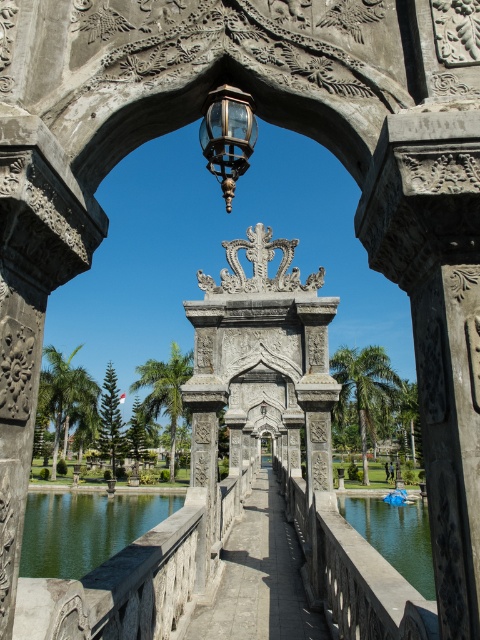
Question: Which point is closer to the camera?

Choices:
 (A) (38, 536)
 (B) (372, 499)
 (C) (216, 620)

Answer: (C)

Question: Which object is the farthest from the gray stone path at center?

Choices:
 (A) green liquid water at bridge center
 (B) matte glass lantern at center
 (C) green reflective water at lower left

Answer: (C)

Question: Which point appears closest to the camera in this image?

Choices:
 (A) (240, 154)
 (B) (105, 554)

Answer: (A)

Question: In this image, where is gray stone path at center located relative to green liquid water at bridge center?

Choices:
 (A) left
 (B) right

Answer: (A)

Question: Can you confirm if gray stone path at center is positioned to the right of matte glass lantern at center?

Choices:
 (A) no
 (B) yes

Answer: (B)

Question: Can you confirm if green reflective water at lower left is positioned to the right of green liquid water at bridge center?

Choices:
 (A) no
 (B) yes

Answer: (A)